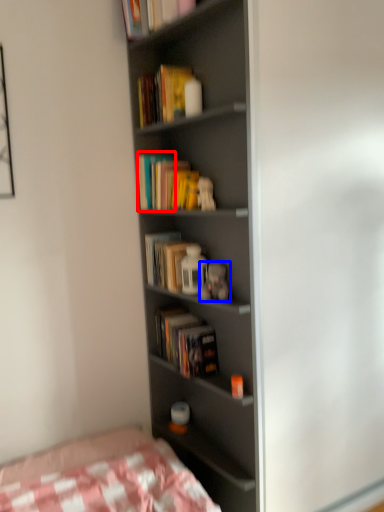
Question: Which of the following is the farthest to the observer, paperback book (highlighted by a red box) or toy (highlighted by a blue box)?

Choices:
 (A) paperback book
 (B) toy

Answer: (A)